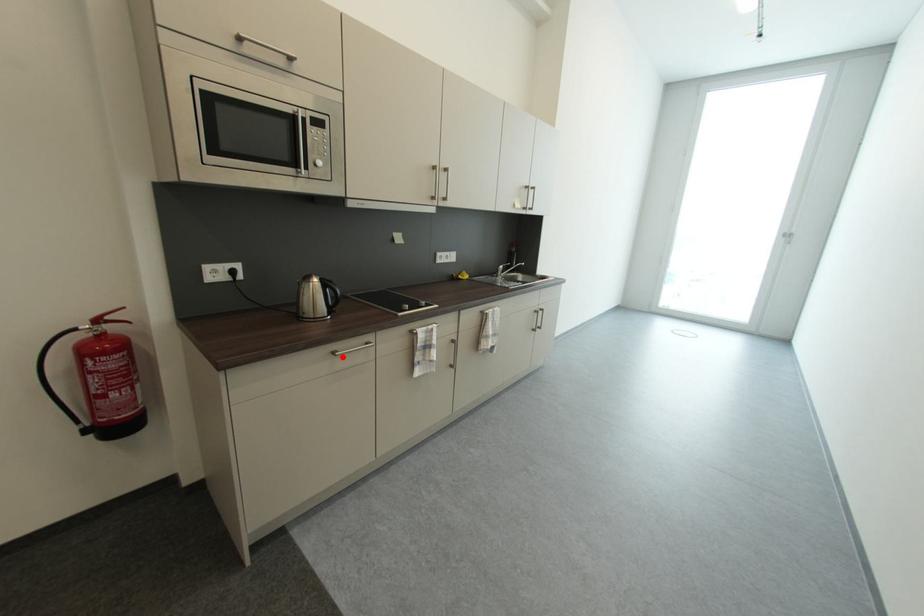
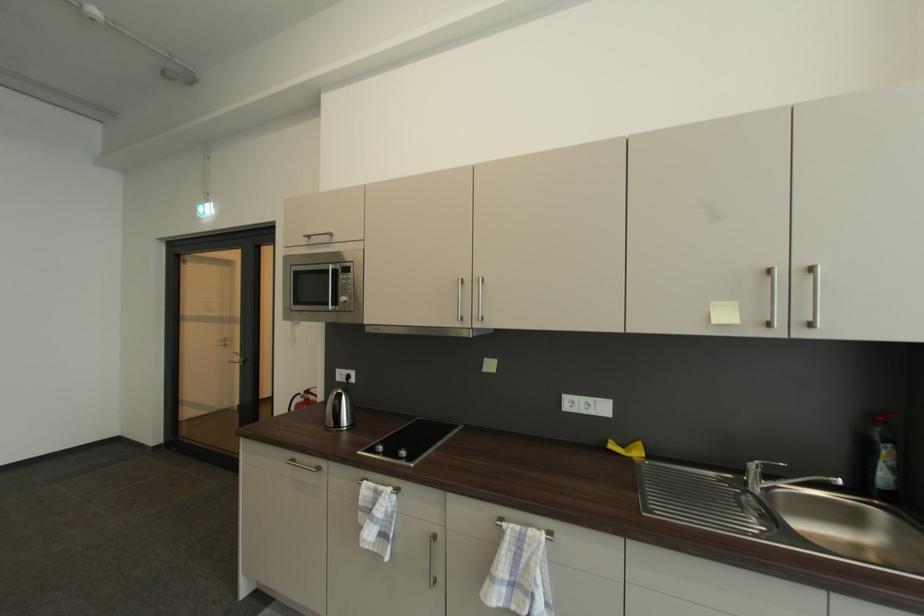
Question: I am providing you with two images of the same scene from different viewpoints. In image1, a red point is highlighted. Considering the same 3D point in image2, which of the following is correct?

Choices:
 (A) It is closer
 (B) It is farther

Answer: (B)